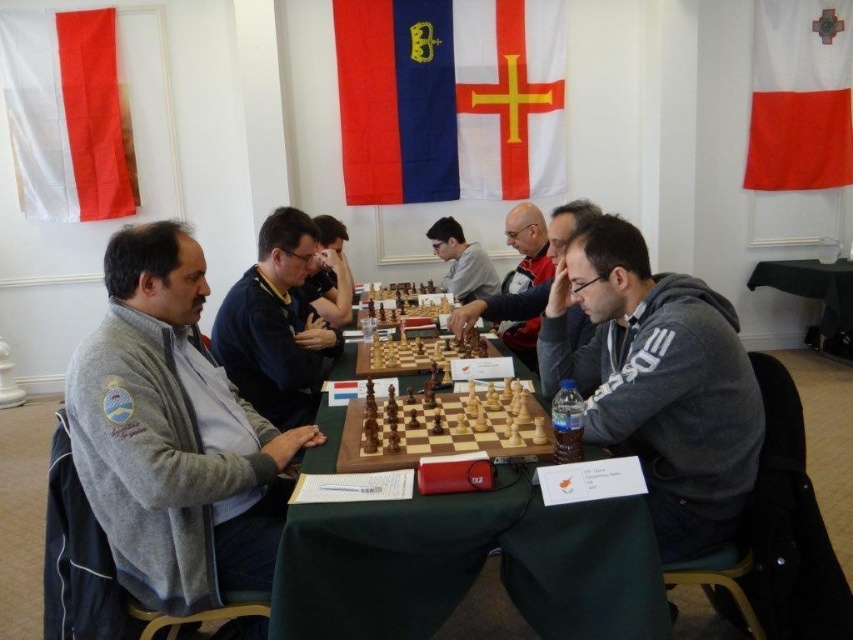
How much distance is there between green fabric table at center and dark blue sweater at center?

green fabric table at center and dark blue sweater at center are 36.83 inches apart from each other.

What do you see at coordinates (468, 564) in the screenshot?
I see `green fabric table at center` at bounding box center [468, 564].

Find the location of a particular element. This screenshot has width=853, height=640. green fabric table at center is located at coordinates (468, 564).

Is white fabric flag at upper left above green fabric table at lower right?

Indeed, white fabric flag at upper left is positioned over green fabric table at lower right.

Which of these two, white fabric flag at upper left or green fabric table at lower right, stands taller?

With more height is white fabric flag at upper left.

What do you see at coordinates (65, 113) in the screenshot? This screenshot has width=853, height=640. I see `white fabric flag at upper left` at bounding box center [65, 113].

The width and height of the screenshot is (853, 640). Identify the location of white fabric flag at upper left. [65, 113].

Based on the photo, is white fabric flag at upper right thinner than green fabric table at lower right?

No, white fabric flag at upper right is not thinner than green fabric table at lower right.

Where is `white fabric flag at upper right`? white fabric flag at upper right is located at coordinates (799, 96).

Identify the location of white fabric flag at upper right. The image size is (853, 640). (799, 96).